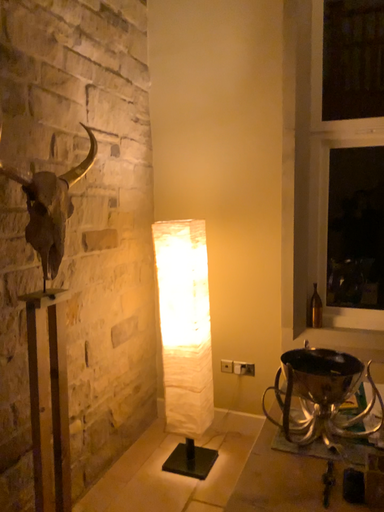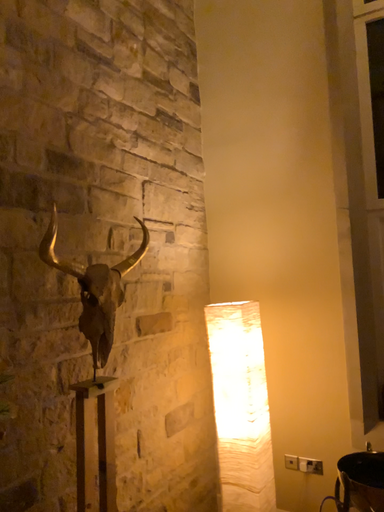
Question: Which way did the camera rotate in the video?

Choices:
 (A) rotated downward
 (B) rotated upward

Answer: (B)